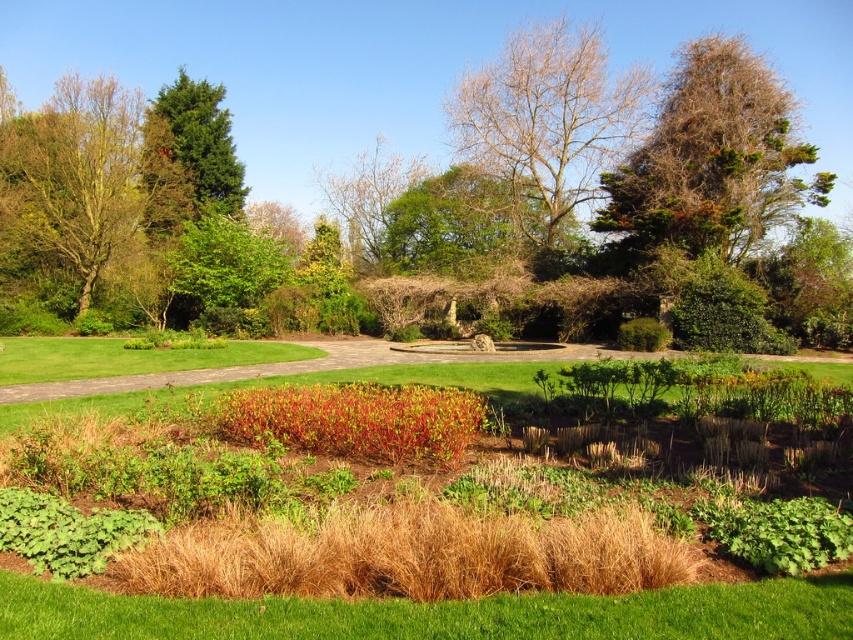
Question: Is brown/dried wood tree at upper right in front of bright red foliage at center?

Choices:
 (A) yes
 (B) no

Answer: (B)

Question: Which object is the closest to the green grass at lower center?

Choices:
 (A) green leafy tree at left
 (B) brown/dried wood tree at upper right
 (C) bright red foliage at center

Answer: (C)

Question: Is green glossy tree at upper left in front of bare branches at center?

Choices:
 (A) no
 (B) yes

Answer: (B)

Question: Which of the following is the farthest from the observer?

Choices:
 (A) green leafy tree at center
 (B) bare branches at upper center
 (C) brown/dried wood tree at upper right
 (D) bright red foliage at center

Answer: (A)

Question: Which is farther from the green leafy tree at left?

Choices:
 (A) green grass at lower center
 (B) bare branches at center
 (C) green glossy tree at upper left

Answer: (A)

Question: Observing the image, what is the correct spatial positioning of brown/dried wood tree at upper right in reference to bright red foliage at center?

Choices:
 (A) above
 (B) below

Answer: (A)